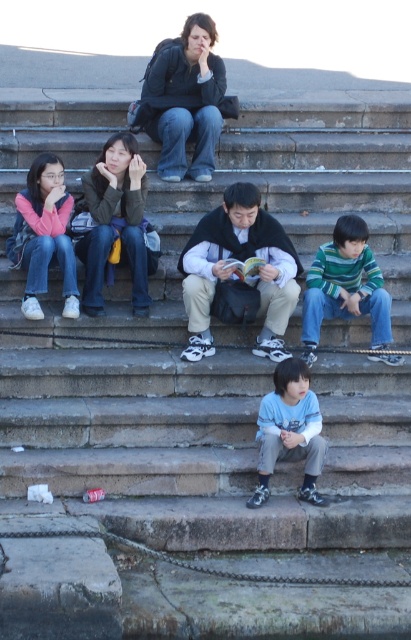
Question: Which of the following is the closest to the observer?

Choices:
 (A) matte green jacket at center
 (B) black matte jacket at center
 (C) light blue cotton shirt at lower center

Answer: (C)

Question: Estimate the real-world distances between objects in this image. Which object is closer to the stone steps at center?

Choices:
 (A) matte pink sweater at left
 (B) light blue cotton shirt at lower center

Answer: (B)

Question: Estimate the real-world distances between objects in this image. Which object is farther from the light blue cotton shirt at lower center?

Choices:
 (A) matte pink sweater at left
 (B) matte green jacket at center
 (C) stone steps at center
 (D) striped knit sweater at right

Answer: (C)

Question: Does black matte jacket at center appear on the right side of light blue cotton shirt at lower center?

Choices:
 (A) no
 (B) yes

Answer: (A)

Question: Does striped knit sweater at right appear under light blue cotton shirt at lower center?

Choices:
 (A) yes
 (B) no

Answer: (B)

Question: Does stone steps at center have a greater width compared to matte pink sweater at left?

Choices:
 (A) no
 (B) yes

Answer: (A)